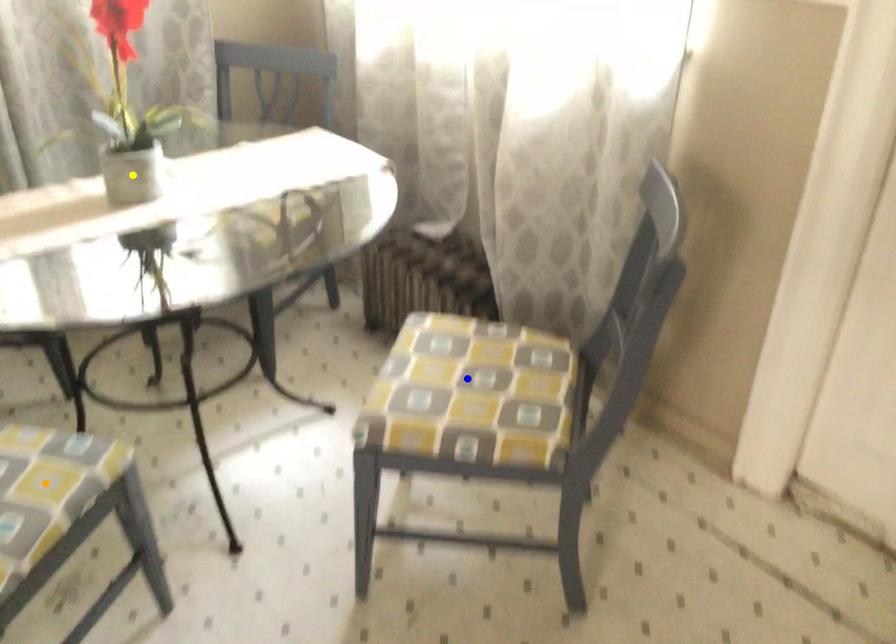
Order these from farthest to nearest:
1. orange point
2. blue point
3. yellow point

yellow point → blue point → orange point